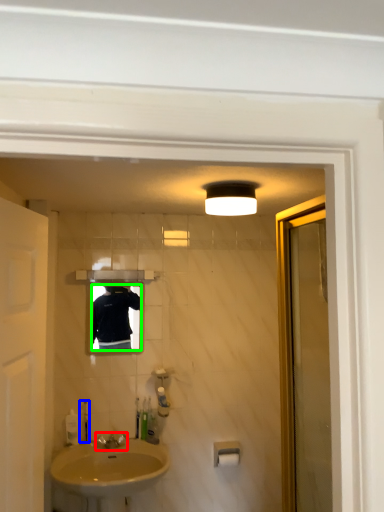
Question: Which object is the closest to the tap (highlighted by a red box)? Choose among these: soap dispenser (highlighted by a blue box) or mirror (highlighted by a green box).

Choices:
 (A) soap dispenser
 (B) mirror

Answer: (A)